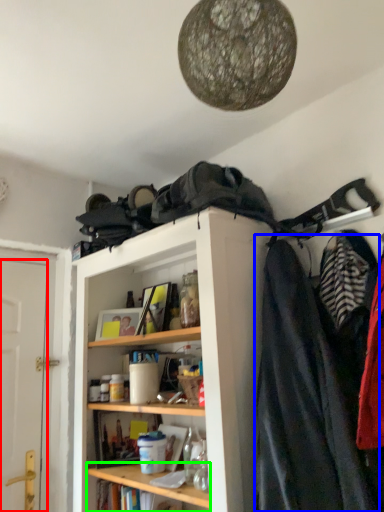
Question: Considering the real-world distances, which object is farthest from door (highlighted by a red box)? cloak (highlighted by a blue box) or cabinet (highlighted by a green box)?

Choices:
 (A) cloak
 (B) cabinet

Answer: (A)